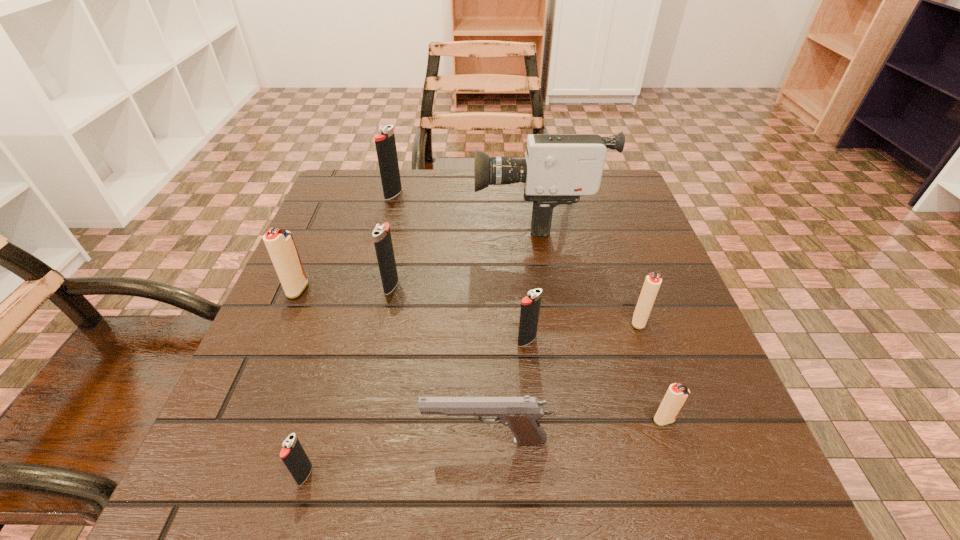
This screenshot has width=960, height=540. Identify the location of free point located on the right of the farthest black igniter. (441, 194).

Where is `vacant space located on the right of the biggest red igniter`? Image resolution: width=960 pixels, height=540 pixels. vacant space located on the right of the biggest red igniter is located at coordinates (352, 289).

Where is `free space located 0.270m on the back of the fourth igniter from right to left`? This screenshot has width=960, height=540. free space located 0.270m on the back of the fourth igniter from right to left is located at coordinates (409, 203).

This screenshot has height=540, width=960. Identify the location of free space located 0.170m on the right of the rightmost black igniter. (634, 341).

Where is `vacant area situated on the back of the second biggest red igniter`? vacant area situated on the back of the second biggest red igniter is located at coordinates (599, 207).

Locate an element on the screen. The image size is (960, 540). free region located 0.270m at the barrel of the eighth farthest object is located at coordinates (240, 441).

Identify the location of free space located 0.130m at the barrel of the eighth farthest object. The image size is (960, 540). (336, 441).

Find the location of a particular element. vacant point located at the barrel of the eighth farthest object is located at coordinates (391, 441).

Where is `blank space located on the left of the nearest red igniter`? The height and width of the screenshot is (540, 960). blank space located on the left of the nearest red igniter is located at coordinates (561, 420).

What are the coordinates of `vacant space located 0.380m on the right of the nearest igniter` in the screenshot? It's located at (587, 475).